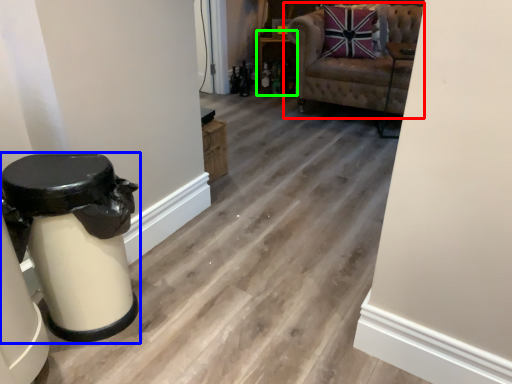
Question: Which is farther away from chair (highlighted by a red box)? bar stool (highlighted by a blue box) or furniture (highlighted by a green box)?

Choices:
 (A) bar stool
 (B) furniture

Answer: (A)